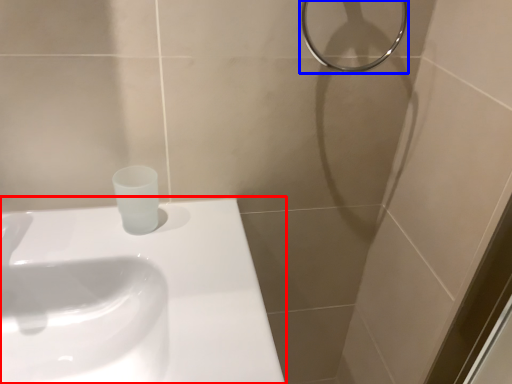
Question: Which object is further to the camera taking this photo, sink (highlighted by a red box) or shower (highlighted by a blue box)?

Choices:
 (A) sink
 (B) shower

Answer: (B)